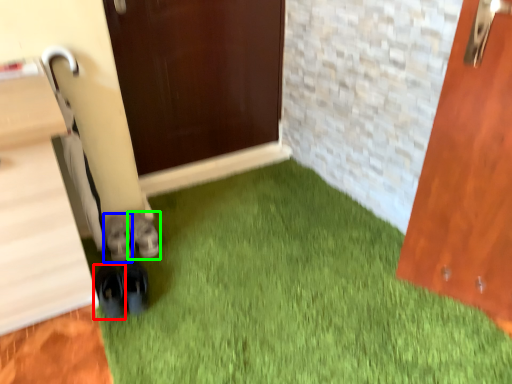
Question: Estimate the real-world distances between objects in this image. Which object is farther from footwear (highlighted by a red box), footwear (highlighted by a blue box) or footwear (highlighted by a green box)?

Choices:
 (A) footwear
 (B) footwear

Answer: (B)